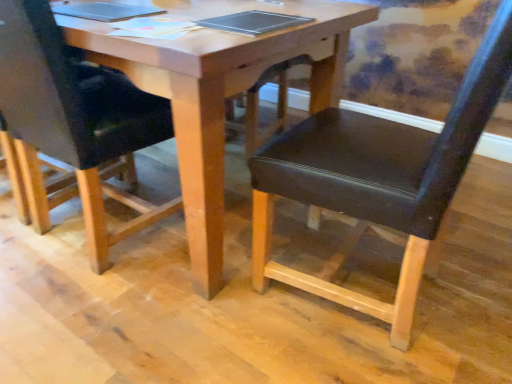
Question: Is metallic silver notebook at center taller than wooden table at center?

Choices:
 (A) no
 (B) yes

Answer: (A)

Question: Could you tell me if metallic silver notebook at center is turned towards wooden table at center?

Choices:
 (A) yes
 (B) no

Answer: (A)

Question: From a real-world perspective, is metallic silver notebook at center positioned under wooden table at center based on gravity?

Choices:
 (A) no
 (B) yes

Answer: (A)

Question: Is metallic silver notebook at center surrounding wooden table at center?

Choices:
 (A) yes
 (B) no

Answer: (B)

Question: From the image's perspective, is metallic silver notebook at center beneath wooden table at center?

Choices:
 (A) no
 (B) yes

Answer: (A)

Question: In terms of width, does black leather chair at center, which ranks as the 2th chair in right-to-left order, look wider or thinner when compared to black leather chair at center, acting as the first chair starting from the right?

Choices:
 (A) wide
 (B) thin

Answer: (A)

Question: Is point (20, 132) closer or farther from the camera than point (434, 147)?

Choices:
 (A) closer
 (B) farther

Answer: (B)

Question: From a real-world perspective, is black leather chair at center, acting as the 1th chair starting from the left, physically located above or below black leather chair at center, marked as the second chair in a left-to-right arrangement?

Choices:
 (A) above
 (B) below

Answer: (B)

Question: From the image's perspective, relative to black leather chair at center, acting as the first chair starting from the right, is black leather chair at center, acting as the 1th chair starting from the left, above or below?

Choices:
 (A) above
 (B) below

Answer: (A)

Question: From the image's perspective, is metallic silver notebook at center above or below black leather chair at center, acting as the first chair starting from the right?

Choices:
 (A) above
 (B) below

Answer: (A)

Question: Does point (261, 34) appear closer or farther from the camera than point (499, 84)?

Choices:
 (A) farther
 (B) closer

Answer: (A)

Question: Would you say metallic silver notebook at center is to the left or to the right of black leather chair at center, marked as the second chair in a left-to-right arrangement, in the picture?

Choices:
 (A) right
 (B) left

Answer: (B)

Question: Is metallic silver notebook at center inside the boundaries of black leather chair at center, acting as the first chair starting from the right, or outside?

Choices:
 (A) outside
 (B) inside

Answer: (A)

Question: Looking at the image, does black leather chair at center, which ranks as the 2th chair in right-to-left order, seem bigger or smaller compared to metallic silver notebook at center?

Choices:
 (A) small
 (B) big

Answer: (B)

Question: From a real-world perspective, relative to metallic silver notebook at center, is black leather chair at center, which ranks as the 2th chair in right-to-left order, vertically above or below?

Choices:
 (A) above
 (B) below

Answer: (B)